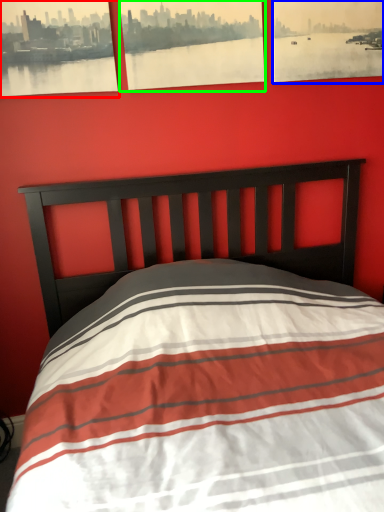
Question: Which is nearer to the picture frame (highlighted by a red box)? picture frame (highlighted by a blue box) or picture frame (highlighted by a green box).

Choices:
 (A) picture frame
 (B) picture frame

Answer: (B)